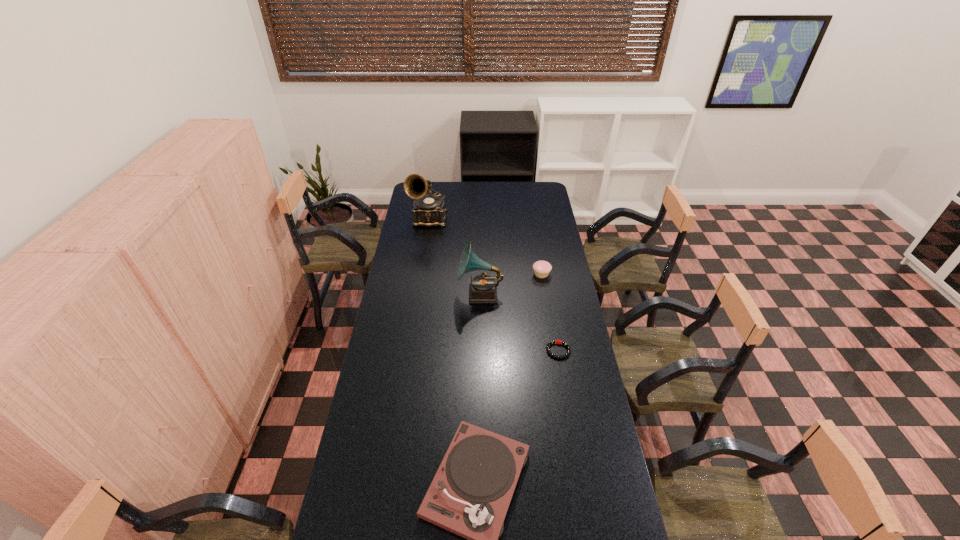
Identify the location of free space between the fourth farthest object and the fourth tallest object. This screenshot has height=540, width=960. (550, 312).

The height and width of the screenshot is (540, 960). Find the location of `the fourth closest object to the shortest object`. the fourth closest object to the shortest object is located at coordinates (429, 209).

Identify which object is the third nearest to the cupcake. Please provide its 2D coordinates. Your answer should be formatted as a tuple, i.e. [(x, y)], where the tuple contains the x and y coordinates of a point satisfying the conditions above.

[(429, 209)]

You are a GUI agent. You are given a task and a screenshot of the screen. Output one action in this format:
    pyautogui.click(x=<x>, y=<y>)
    Task: Click on the phonograph_record that is the third closest to the second shortest object
    
    Given the screenshot: What is the action you would take?
    pyautogui.click(x=470, y=494)

Where is `phonograph_record that can be found as the closest to the leftmost object`? phonograph_record that can be found as the closest to the leftmost object is located at coordinates (482, 289).

Where is `vacant region that satisfies the following two spatial constraints: 1. on the horn of the farthest phonograph_record; 2. on the left side of the bracelet`? The width and height of the screenshot is (960, 540). vacant region that satisfies the following two spatial constraints: 1. on the horn of the farthest phonograph_record; 2. on the left side of the bracelet is located at coordinates (408, 350).

The height and width of the screenshot is (540, 960). Identify the location of free space that satisfies the following two spatial constraints: 1. on the front side of the bracelet; 2. on the left side of the fourth nearest object. (554, 350).

The image size is (960, 540). In order to click on blank space that satisfies the following two spatial constraints: 1. on the back side of the shortest object; 2. from the horn of the third nearest object in this screenshot , I will do `click(549, 294)`.